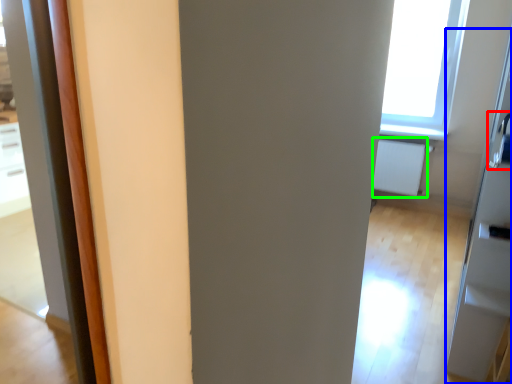
Question: Considering the real-world distances, which object is closest to door handle (highlighted by a red box)? screen door (highlighted by a blue box) or radiator (highlighted by a green box).

Choices:
 (A) screen door
 (B) radiator

Answer: (B)